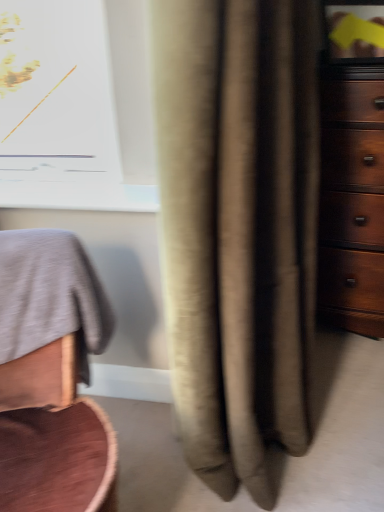
Question: Is point (370, 228) closer or farther from the camera than point (89, 266)?

Choices:
 (A) farther
 (B) closer

Answer: (A)

Question: In the image, is dark wood dresser at right on the left side or the right side of smooth gray fabric at left?

Choices:
 (A) left
 (B) right

Answer: (B)

Question: Which of these objects is positioned farthest from the smooth gray fabric at left?

Choices:
 (A) dark wood dresser at right
 (B) beige fabric curtain at center

Answer: (A)

Question: Based on their relative distances, which object is nearer to the beige fabric curtain at center?

Choices:
 (A) smooth gray fabric at left
 (B) dark wood dresser at right

Answer: (A)